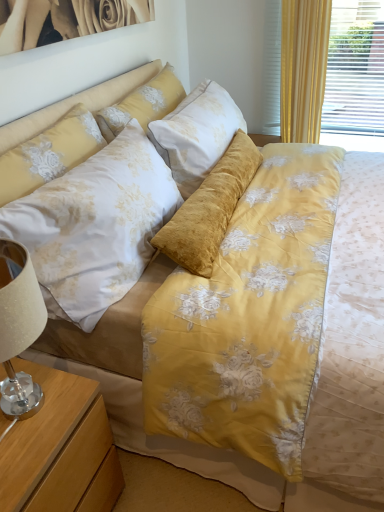
Question: From the image's perspective, does white glossy picture frame at upper left appear lower than floral fabric pillow at upper center, which is the 2th pillow in front-to-back order?

Choices:
 (A) yes
 (B) no

Answer: (B)

Question: Considering the relative positions of white glossy picture frame at upper left and floral fabric pillow at upper center, positioned as the 1th pillow in back-to-front order, in the image provided, is white glossy picture frame at upper left to the left of floral fabric pillow at upper center, positioned as the 1th pillow in back-to-front order, from the viewer's perspective?

Choices:
 (A) no
 (B) yes

Answer: (B)

Question: Is white glossy picture frame at upper left positioned beyond the bounds of floral fabric pillow at upper center, positioned as the 1th pillow in back-to-front order?

Choices:
 (A) yes
 (B) no

Answer: (A)

Question: Is white glossy picture frame at upper left beside floral fabric pillow at upper center, which is the 2th pillow in front-to-back order?

Choices:
 (A) no
 (B) yes

Answer: (A)

Question: From the image's perspective, is white glossy picture frame at upper left on top of floral fabric pillow at upper center, positioned as the 1th pillow in back-to-front order?

Choices:
 (A) yes
 (B) no

Answer: (A)

Question: Can you confirm if white glossy picture frame at upper left is bigger than floral fabric pillow at upper center, positioned as the 1th pillow in back-to-front order?

Choices:
 (A) no
 (B) yes

Answer: (A)

Question: From the image's perspective, is wooden nightstand at lower left located above floral satin pillow at upper left, the 1th pillow from the front?

Choices:
 (A) yes
 (B) no

Answer: (B)

Question: Can you confirm if wooden nightstand at lower left is positioned to the left of floral satin pillow at upper left, the 1th pillow from the front?

Choices:
 (A) no
 (B) yes

Answer: (B)

Question: Can you confirm if wooden nightstand at lower left is positioned to the right of floral satin pillow at upper left, the 1th pillow from the front?

Choices:
 (A) yes
 (B) no

Answer: (B)

Question: Is wooden nightstand at lower left shorter than floral satin pillow at upper left, the 1th pillow from the front?

Choices:
 (A) yes
 (B) no

Answer: (B)

Question: Is wooden nightstand at lower left facing towards floral satin pillow at upper left, the 1th pillow from the front?

Choices:
 (A) no
 (B) yes

Answer: (A)

Question: From the image's perspective, is wooden nightstand at lower left below floral satin pillow at upper left, the 1th pillow from the front?

Choices:
 (A) yes
 (B) no

Answer: (A)

Question: Is floral fabric pillow at upper center, positioned as the 1th pillow in back-to-front order, taller than floral satin pillow at upper left, placed as the 2th pillow when sorted from back to front?

Choices:
 (A) yes
 (B) no

Answer: (B)